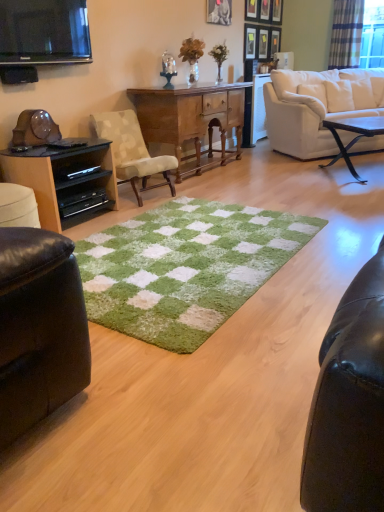
Question: Which direction should I rotate to look at wooden picture frame at upper center, which is the 4th picture frame from right to left, — up or down?

Choices:
 (A) up
 (B) down

Answer: (A)

Question: Is metallic silver picture frame at upper center, acting as the 7th picture frame starting from the right, wider than metallic silver picture frame at upper center, which appears as the third picture frame when viewed from the left?

Choices:
 (A) no
 (B) yes

Answer: (B)

Question: Is metallic silver picture frame at upper center, acting as the 7th picture frame starting from the right, further to camera compared to metallic silver picture frame at upper center, which appears as the third picture frame when viewed from the left?

Choices:
 (A) no
 (B) yes

Answer: (A)

Question: Could you tell me if metallic silver picture frame at upper center, acting as the 7th picture frame starting from the right, is turned towards metallic silver picture frame at upper center, which is counted as the 5th picture frame, starting from the right?

Choices:
 (A) no
 (B) yes

Answer: (A)

Question: Is metallic silver picture frame at upper center, acting as the 7th picture frame starting from the right, taller than metallic silver picture frame at upper center, which appears as the third picture frame when viewed from the left?

Choices:
 (A) no
 (B) yes

Answer: (A)

Question: Can you see metallic silver picture frame at upper center, the first picture frame positioned from the left, touching metallic silver picture frame at upper center, which appears as the third picture frame when viewed from the left?

Choices:
 (A) yes
 (B) no

Answer: (B)

Question: Is metallic silver picture frame at upper center, the first picture frame positioned from the left, positioned far away from metallic silver picture frame at upper center, which appears as the third picture frame when viewed from the left?

Choices:
 (A) no
 (B) yes

Answer: (A)

Question: Is wooden picture frame at upper center, the fifth picture frame positioned from the left, oriented towards beige fabric chair at center?

Choices:
 (A) no
 (B) yes

Answer: (A)

Question: Does wooden picture frame at upper center, the fifth picture frame positioned from the left, appear on the left side of beige fabric chair at center?

Choices:
 (A) yes
 (B) no

Answer: (B)

Question: From the image's perspective, does wooden picture frame at upper center, the fifth picture frame positioned from the left, appear lower than beige fabric chair at center?

Choices:
 (A) yes
 (B) no

Answer: (B)

Question: Is wooden picture frame at upper center, placed as the third picture frame when sorted from right to left, looking in the opposite direction of beige fabric chair at center?

Choices:
 (A) yes
 (B) no

Answer: (B)

Question: Is wooden picture frame at upper center, the fifth picture frame positioned from the left, smaller than beige fabric chair at center?

Choices:
 (A) yes
 (B) no

Answer: (A)

Question: Is the surface of wooden picture frame at upper center, the fifth picture frame positioned from the left, in direct contact with beige fabric chair at center?

Choices:
 (A) no
 (B) yes

Answer: (A)

Question: From a real-world perspective, is green fuzzy plant at upper center, the second houseplant when ordered from right to left, positioned over wooden picture frame at upper center, which is the 2th picture frame from right to left, based on gravity?

Choices:
 (A) yes
 (B) no

Answer: (B)